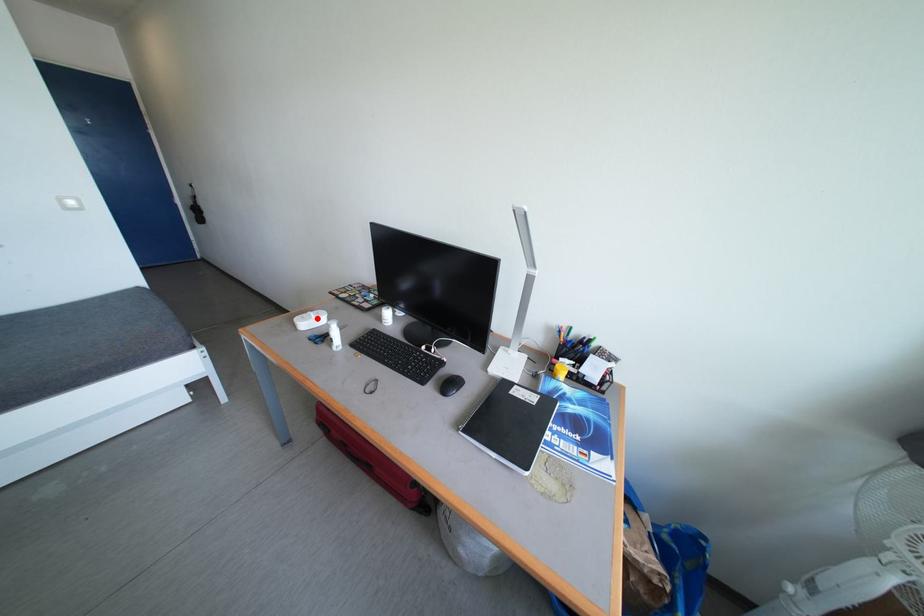
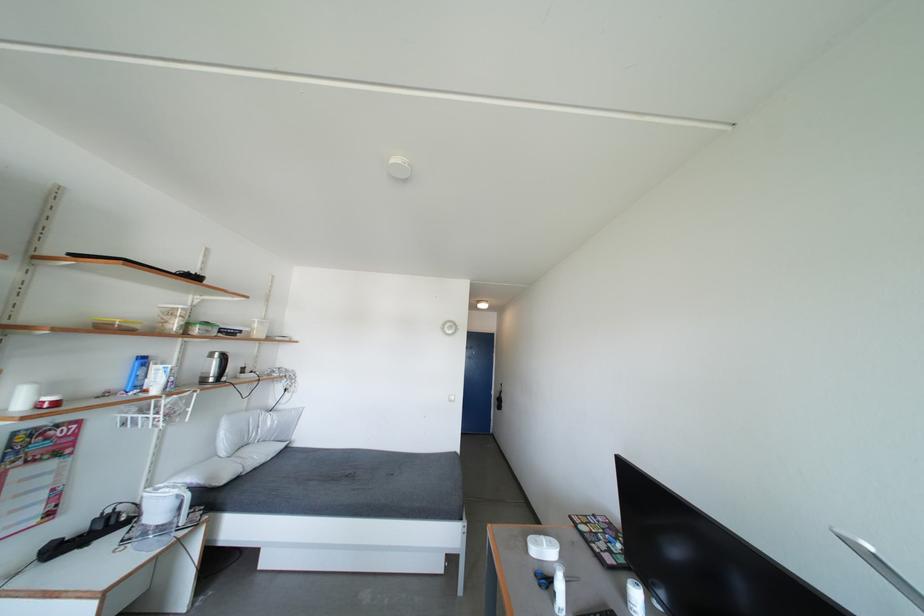
Locate, in the second image, the point that corresponds to the highlighted location in the first image.

(550, 544)